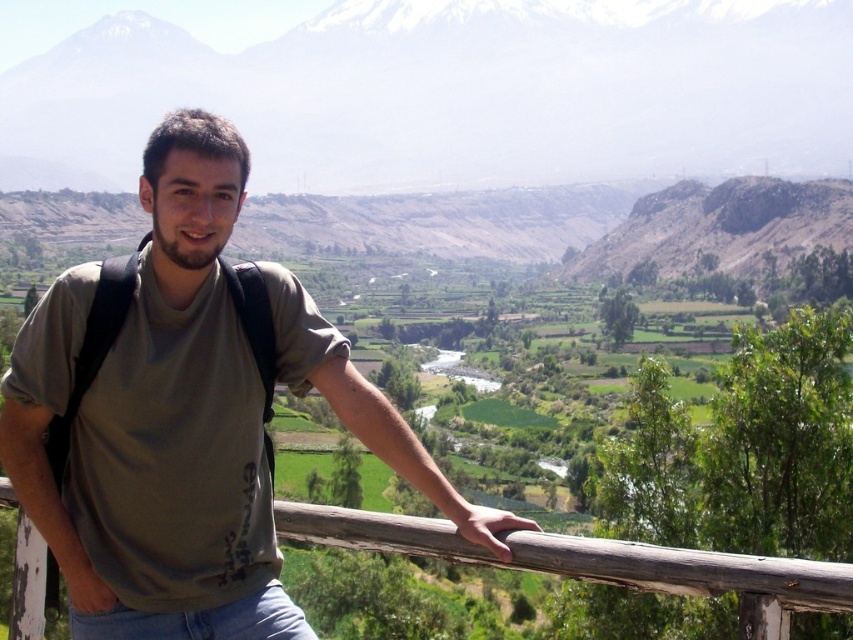
You are taking a photo of the person and the landscape. The camera is at your eye level. You want to focus on the person first, then the background. Which point, point (155, 410) or point (723, 557), should you focus on first?

You should focus on point (155, 410) first because it is closer to the camera than point (723, 557).